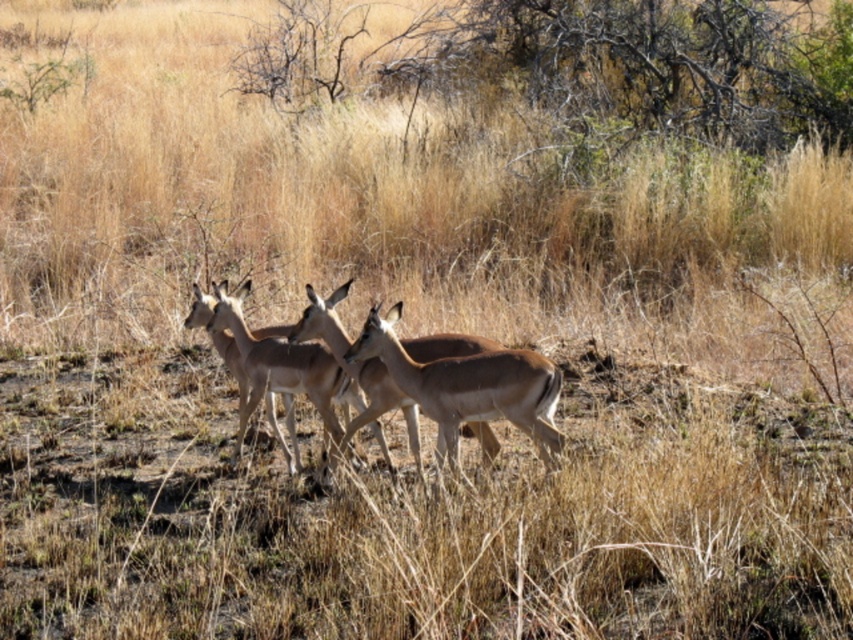
Question: Can you confirm if brown glossy antelope at center is bigger than brown fur antelope at center?

Choices:
 (A) yes
 (B) no

Answer: (A)

Question: Which object appears farthest from the camera in this image?

Choices:
 (A) brown fur antelope at center
 (B) brown matte deer at center

Answer: (A)

Question: Is brown glossy antelope at center bigger than brown matte deer at center?

Choices:
 (A) yes
 (B) no

Answer: (A)

Question: Can you confirm if brown glossy antelope at center is wider than brown matte deer at center?

Choices:
 (A) no
 (B) yes

Answer: (B)

Question: Which point is closer to the camera?

Choices:
 (A) (328, 417)
 (B) (306, 388)
 (C) (444, 410)

Answer: (C)

Question: Which is farther from the brown matte deer at center?

Choices:
 (A) brown fur antelope at center
 (B) brown glossy antelope at center

Answer: (A)